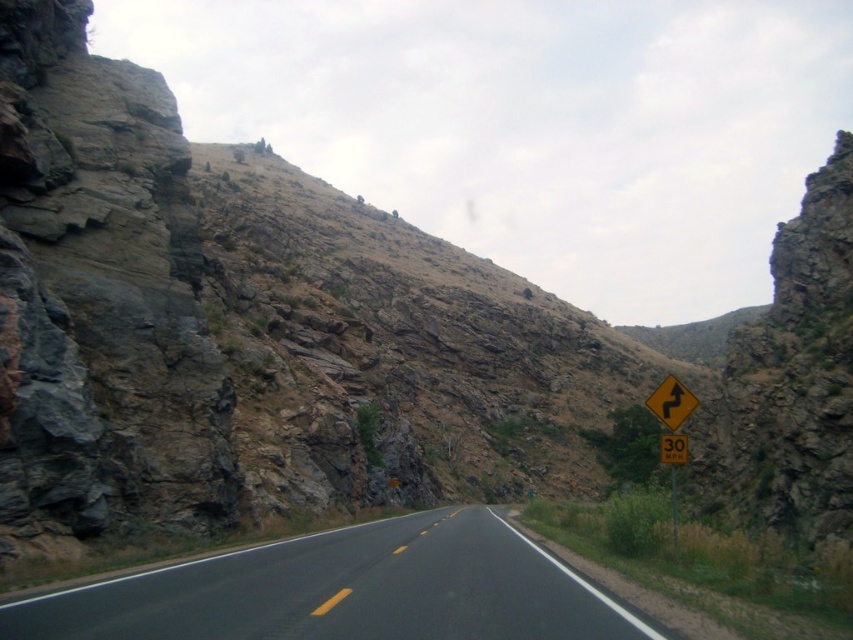
You are driving a car and see the black asphalt road at center and the yellow reflective plastic at right. Which object is closer to the driver when looking straight ahead?

The black asphalt road at center is positioned on the left side of yellow reflective plastic at right, so it is closer to the driver when looking straight ahead.

You are driving a delivery truck and need to navigate the mountain road. You see the yellow reflective plastic at right and the yellow plastic speed limit sign at center. Which object is closer to the road surface?

The yellow reflective plastic at right is positioned under the yellow plastic speed limit sign at center, so it is closer to the road surface.

You are driving a car and see the black asphalt road at center and the yellow reflective plastic at right. Which object takes up more space in the image?

The yellow reflective plastic at right takes up more space in the image than the black asphalt road at center because the black asphalt road at center has a smaller size compared to yellow reflective plastic at right.